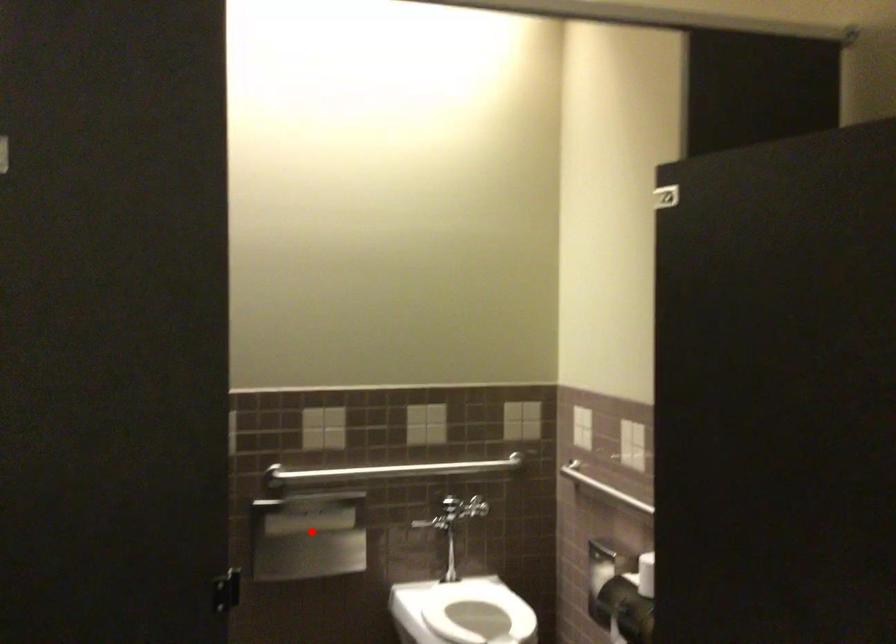
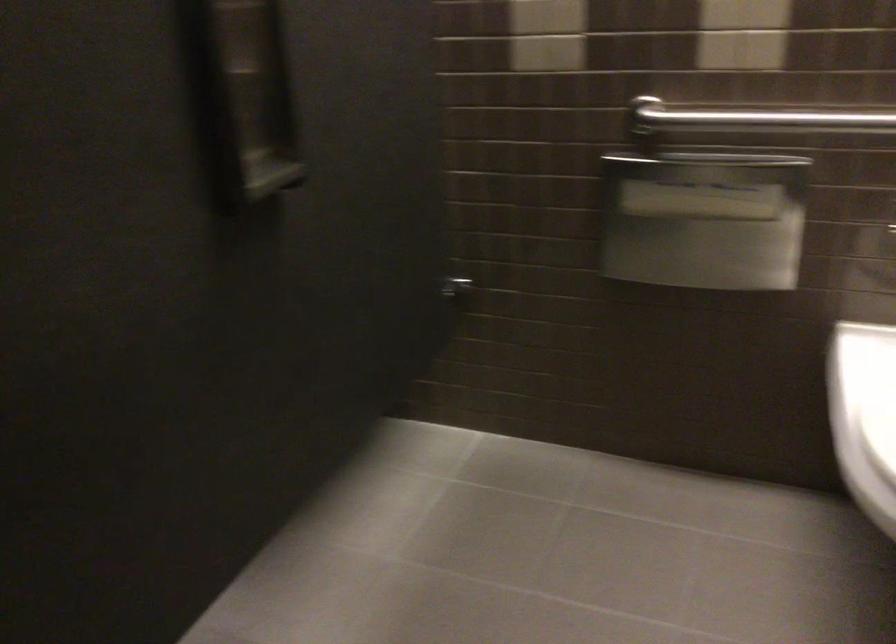
The point at the highlighted location is marked in the first image. Where is the corresponding point in the second image?

(703, 220)